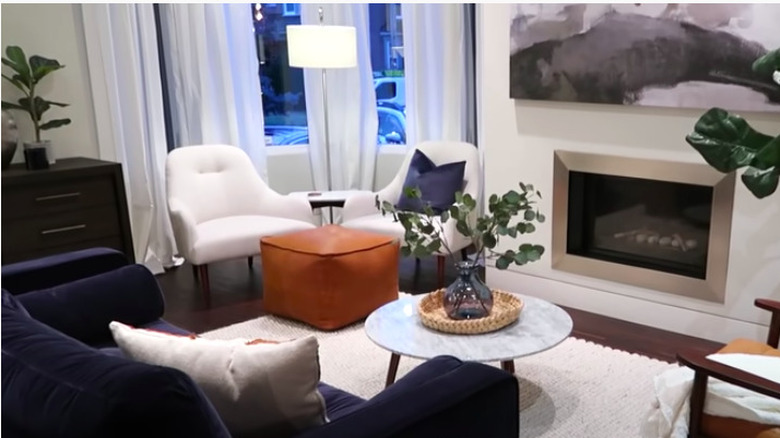
At what (x,y) coordinates should I click in order to perform the action: click on vases. Please return your answer as a coordinate pair (x, y). This screenshot has width=780, height=438. Looking at the image, I should click on (8, 133), (459, 295).